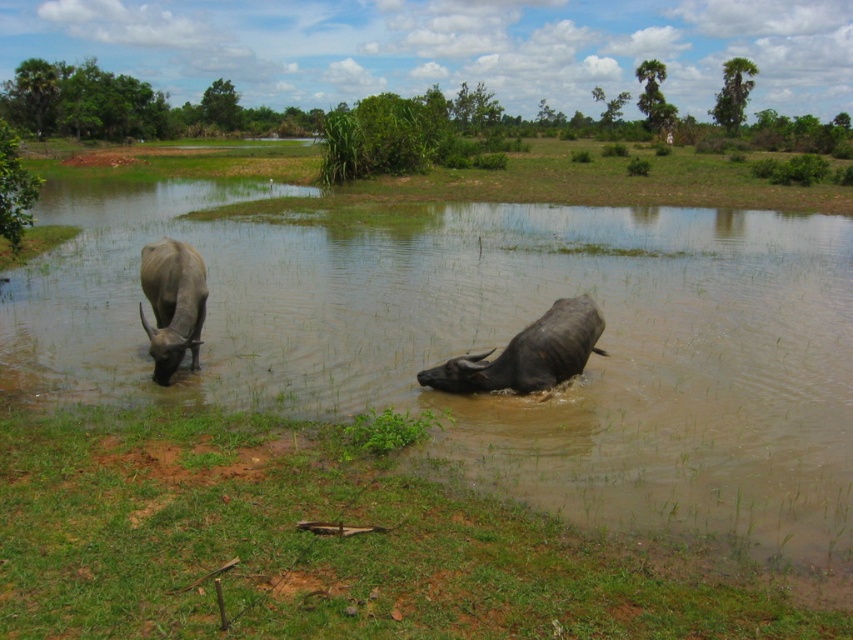
You are standing at the point labeled point (693, 560) and want to reach the point labeled point (460, 369). Which direction should you move to get closer to your destination?

You should move away from the camera because point (460, 369) is further from the camera than point (693, 560).

You are a farmer checking the water levels in the field. You see the dark gray wet bull at center and the gray matte yak at left. Which animal is closer to the water surface?

The dark gray wet bull at center is shorter than the gray matte yak at left, so it is closer to the water surface.

You are a farmer checking the field. You see the green grass at lower left and the dark gray wet bull at center. Which one is bigger in size?

The green grass at lower left is larger in size compared to the dark gray wet bull at center according to the description.